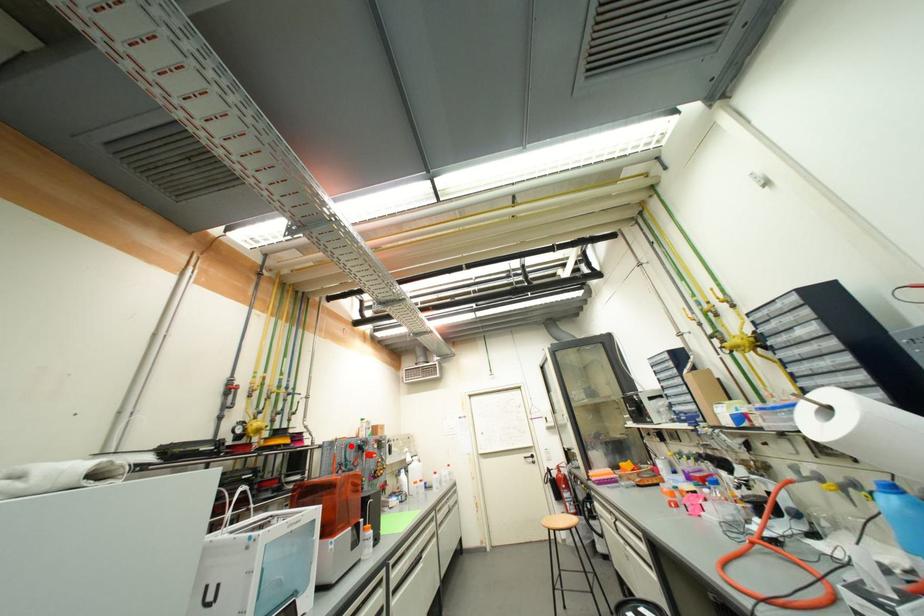
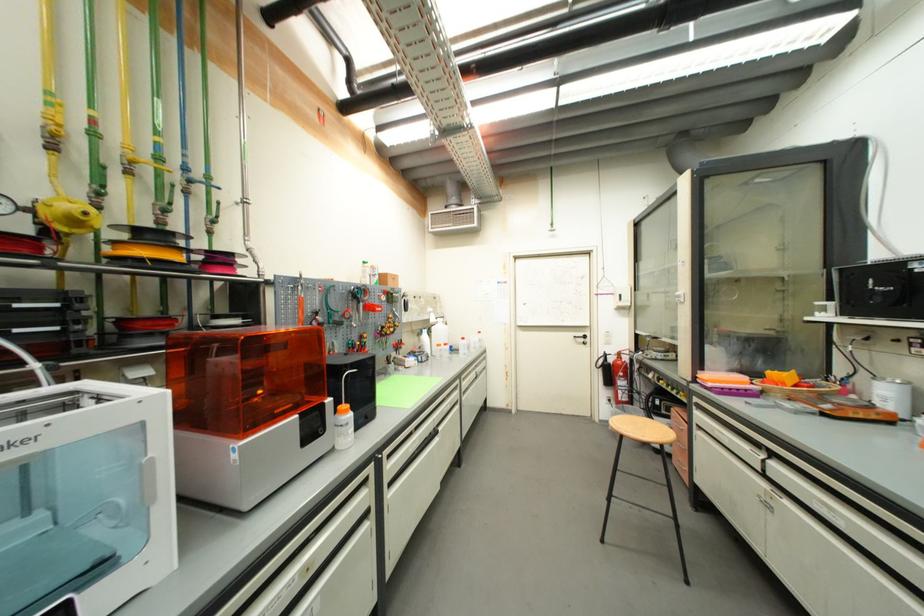
Question: I am providing you with two images of the same scene from different viewpoints. A red point is shown in image1. For the corresponding object point in image2, is it positioned nearer or farther from the camera?

Choices:
 (A) Nearer
 (B) Farther

Answer: (A)